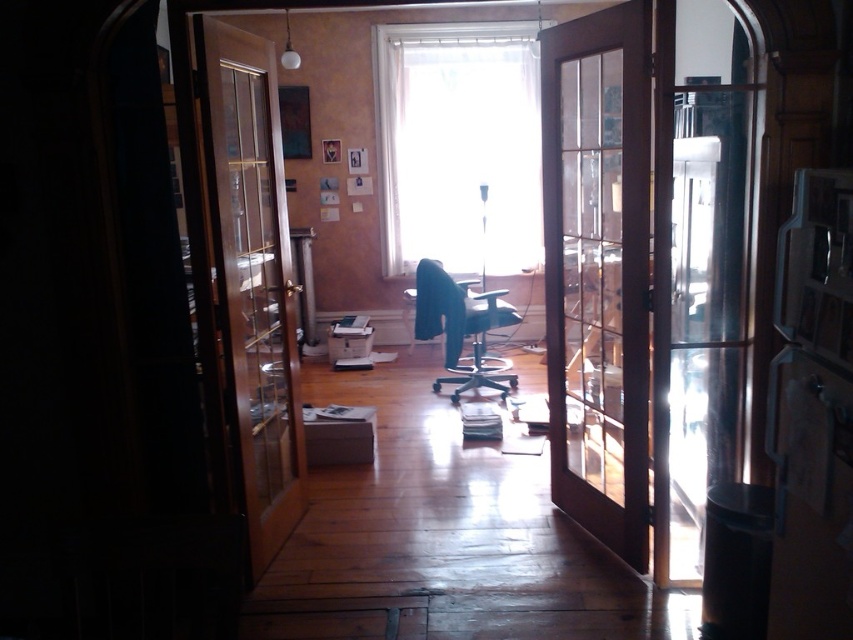
Between wooden door at left and satin silver refrigerator at right, which one appears on the left side from the viewer's perspective?

wooden door at left

Does point (282, 380) come behind point (743, 300)?

That is True.

Does point (248, 294) come in front of point (683, 538)?

No, it is behind (683, 538).

Locate an element on the screen. wooden door at left is located at coordinates (252, 278).

Can you confirm if satin silver refrigerator at right is shorter than matte black swivel chair at center?

No, satin silver refrigerator at right is not shorter than matte black swivel chair at center.

You are a GUI agent. You are given a task and a screenshot of the screen. Output one action in this format:
    pyautogui.click(x=<x>, y=<y>)
    Task: Click on the satin silver refrigerator at right
    The width and height of the screenshot is (853, 640).
    Given the screenshot: What is the action you would take?
    pyautogui.click(x=705, y=307)

Does point (215, 96) come behind point (426, 333)?

No, (215, 96) is closer to viewer.

Who is higher up, wooden door at left or matte black swivel chair at center?

wooden door at left is higher up.

Does point (289, 332) come farther from viewer compared to point (444, 268)?

No.

You are a GUI agent. You are given a task and a screenshot of the screen. Output one action in this format:
    pyautogui.click(x=<x>, y=<y>)
    Task: Click on the wooden door at left
    
    Given the screenshot: What is the action you would take?
    pyautogui.click(x=252, y=278)